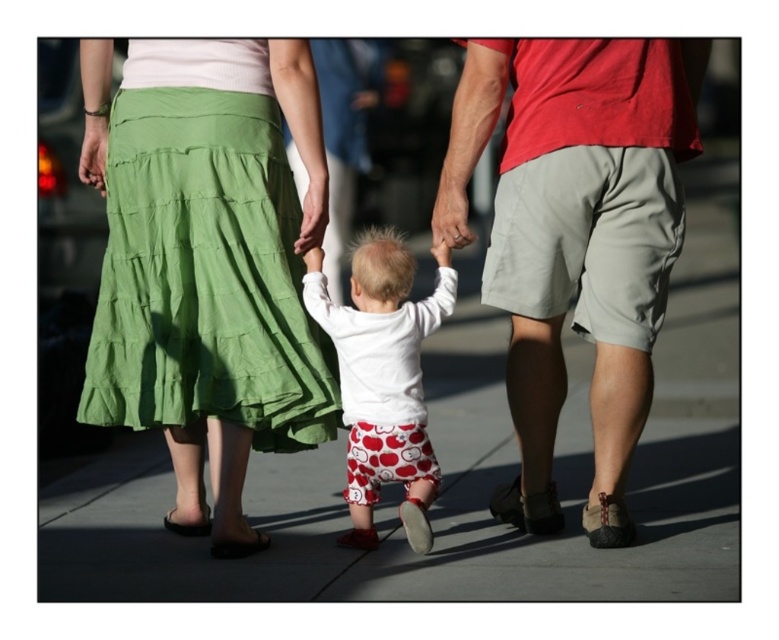
Who is more forward, (249, 540) or (175, 524)?

Point (249, 540)

Who is positioned more to the right, black leather sandal at lower center or black leather sandal at lower left?

Positioned to the right is black leather sandal at lower center.

Which is in front, point (226, 544) or point (182, 532)?

Point (226, 544) is in front.

At what (x,y) coordinates should I click in order to perform the action: click on black leather sandal at lower center. Please return your answer as a coordinate pair (x, y). Looking at the image, I should click on (238, 545).

Is point (287, 483) farther from camera compared to point (240, 548)?

Yes, it is behind point (240, 548).

Which of these two, gray concrete pavement at center or black leather sandal at lower center, stands taller?

Standing taller between the two is gray concrete pavement at center.

What do you see at coordinates (460, 474) in the screenshot? The height and width of the screenshot is (640, 779). I see `gray concrete pavement at center` at bounding box center [460, 474].

At what (x,y) coordinates should I click in order to perform the action: click on gray concrete pavement at center. Please return your answer as a coordinate pair (x, y). The width and height of the screenshot is (779, 640). Looking at the image, I should click on (460, 474).

Who is shorter, gray concrete pavement at center or green cotton skirt at upper left?

With less height is green cotton skirt at upper left.

What do you see at coordinates (460, 474) in the screenshot? This screenshot has height=640, width=779. I see `gray concrete pavement at center` at bounding box center [460, 474].

Is point (64, 483) more distant than point (212, 438)?

Yes, point (64, 483) is farther from viewer.

Locate an element on the screen. The width and height of the screenshot is (779, 640). gray concrete pavement at center is located at coordinates (460, 474).